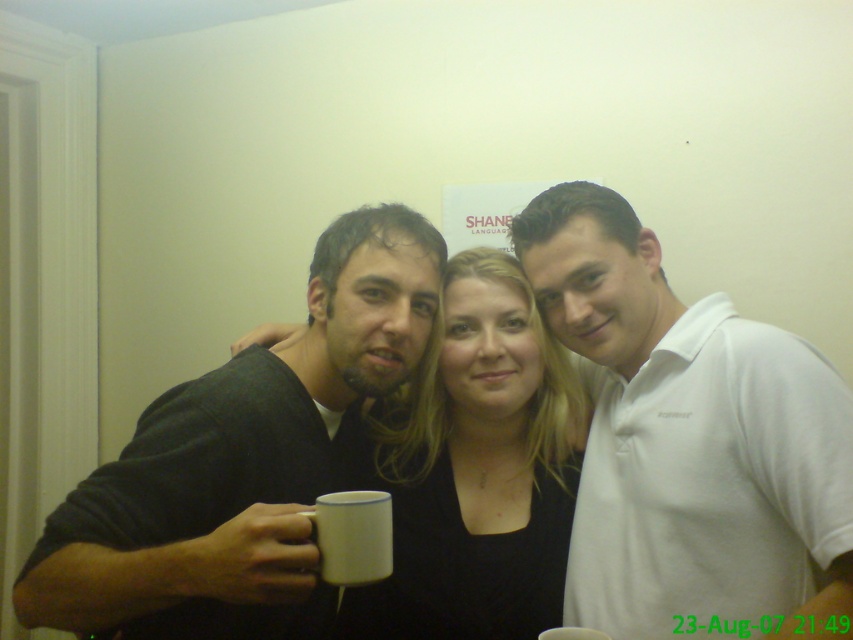
You are a photographer trying to adjust the lighting for a portrait. You notice the matte black shirt at center and the white matte mug at center in the frame. Which object should you focus the light on to ensure it is properly illuminated, considering their positions?

The matte black shirt at center is positioned under the white matte mug at center, so focusing the light on the matte black shirt at center would ensure it receives adequate illumination as it is lower in the frame.

You are setting up a photo shoot and need to ensure that the white enamel mug at lower left and the white ceramic mug at center are arranged in a way that the one higher up is not blocking the other. Based on the scene description, which mug should be placed higher to avoid blocking the other?

The white enamel mug at lower left is already positioned above the white ceramic mug at center, so to avoid blocking, the white enamel mug at lower left should remain higher as it is currently placed.

You are a photographer trying to adjust the lighting in the scene. You notice the black matte shirt at center and the white enamel mug at lower left. Which object is closer to the camera, based on their positions?

The black matte shirt at center is positioned over the white enamel mug at lower left, meaning it is closer to the camera.